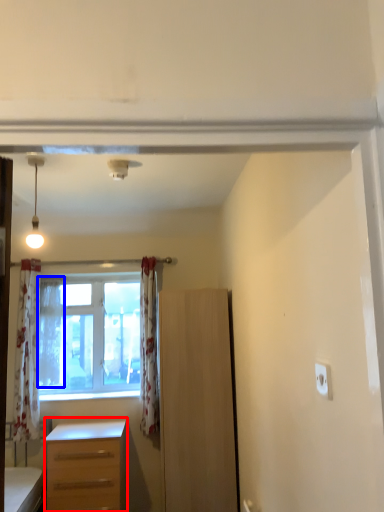
Question: Which object appears farthest to the camera in this image, desk (highlighted by a red box) or curtain (highlighted by a blue box)?

Choices:
 (A) desk
 (B) curtain

Answer: (B)